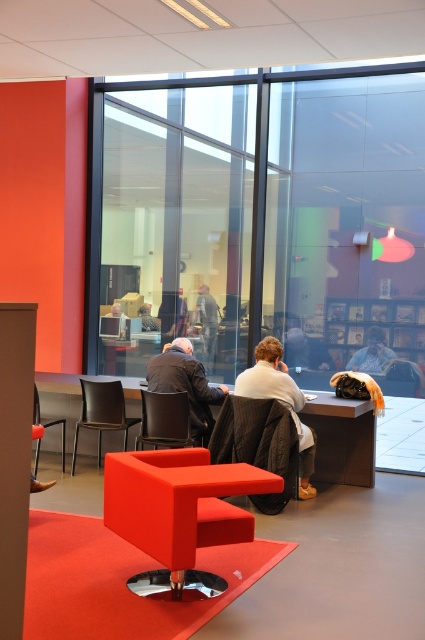
Question: Estimate the real-world distances between objects in this image. Which object is farther from the white fabric jacket at center?

Choices:
 (A) matte black jacket at center
 (B) dark gray suit at center
 (C) dark gray fabric jacket at center
 (D) matte black chair at center

Answer: (A)

Question: Is black leather chair at center positioned in front of matte black chair at center?

Choices:
 (A) no
 (B) yes

Answer: (B)

Question: Which object appears farthest from the camera in this image?

Choices:
 (A) black leather chair at center
 (B) smooth beige coat at center
 (C) dark gray fabric jacket at center

Answer: (C)

Question: Among these objects, which one is farthest from the camera?

Choices:
 (A) matte red table at center
 (B) matte black jacket at center
 (C) velvet-like brown chair at center
 (D) black leather chair at center

Answer: (B)

Question: Is black leather chair at center behind matte black jacket at center?

Choices:
 (A) yes
 (B) no

Answer: (B)

Question: Does black leather chair at center have a larger size compared to matte black jacket at center?

Choices:
 (A) no
 (B) yes

Answer: (B)